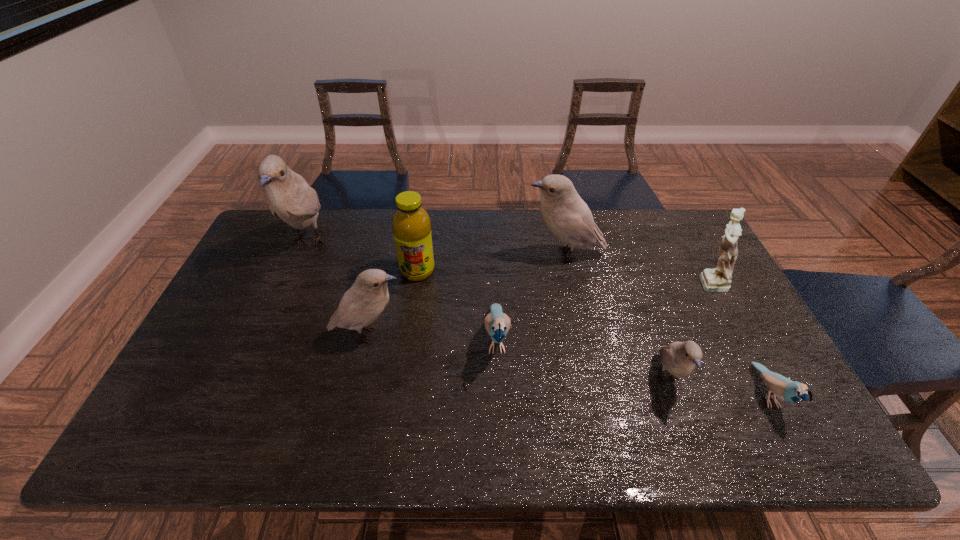
Identify the location of bird that is the third nearest to the third smallest white bird. Image resolution: width=960 pixels, height=540 pixels. point(368,297).

The height and width of the screenshot is (540, 960). What are the coordinates of `white bird object that ranks as the second closest to the shortest object` in the screenshot? It's located at (568, 217).

Locate an element on the screen. white bird that is the second closest one to the figurine is located at coordinates (679, 358).

Locate an element on the screen. free location that satisfies the following two spatial constraints: 1. at the beak of the third smallest white bird; 2. on the front label of the fruit juice is located at coordinates (568, 271).

Where is `vacant space that satisfies the following two spatial constraints: 1. at the beak of the third smallest white bird; 2. at the face of the fourth object from left to right`? This screenshot has width=960, height=540. vacant space that satisfies the following two spatial constraints: 1. at the beak of the third smallest white bird; 2. at the face of the fourth object from left to right is located at coordinates (583, 339).